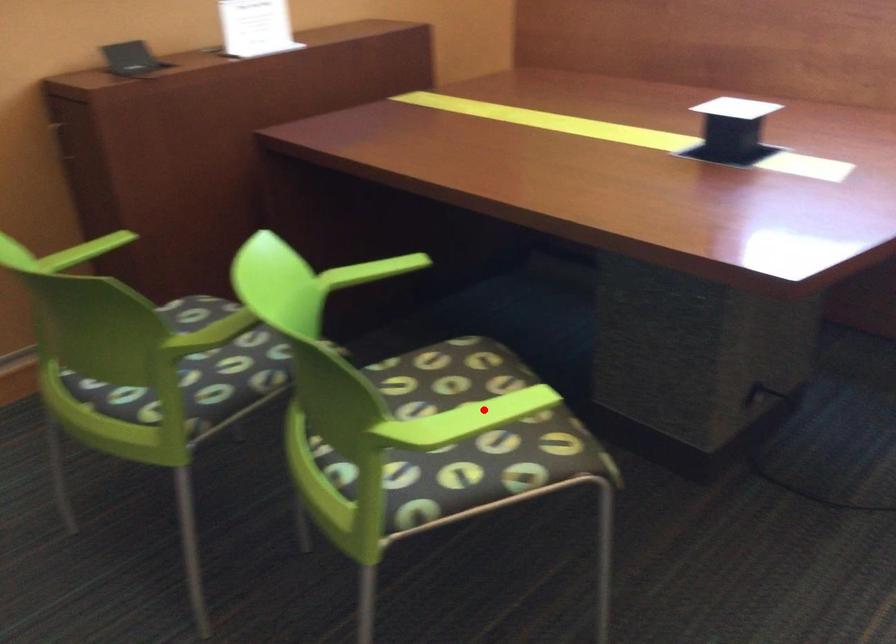
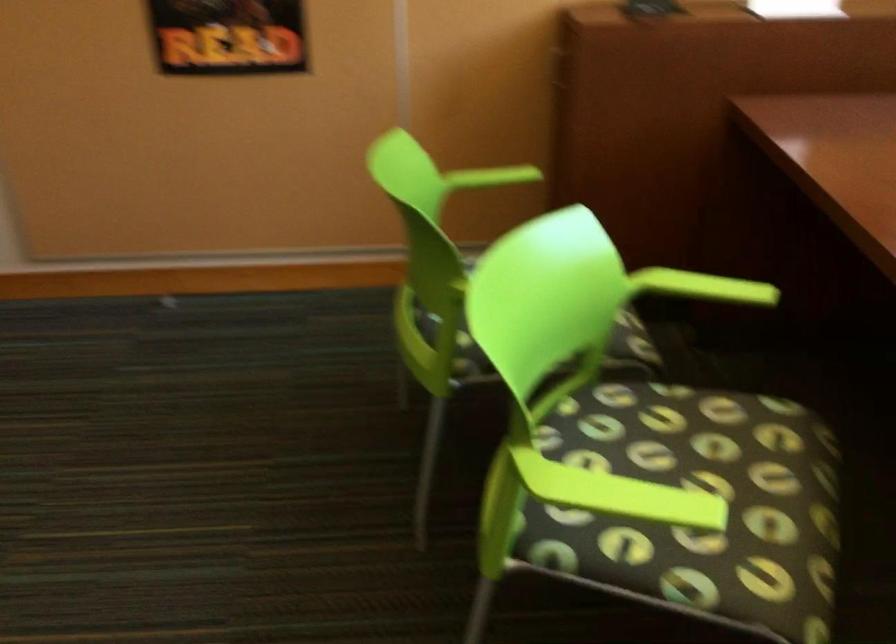
Locate, in the second image, the point that corresponds to the highlighted location in the first image.

(619, 494)